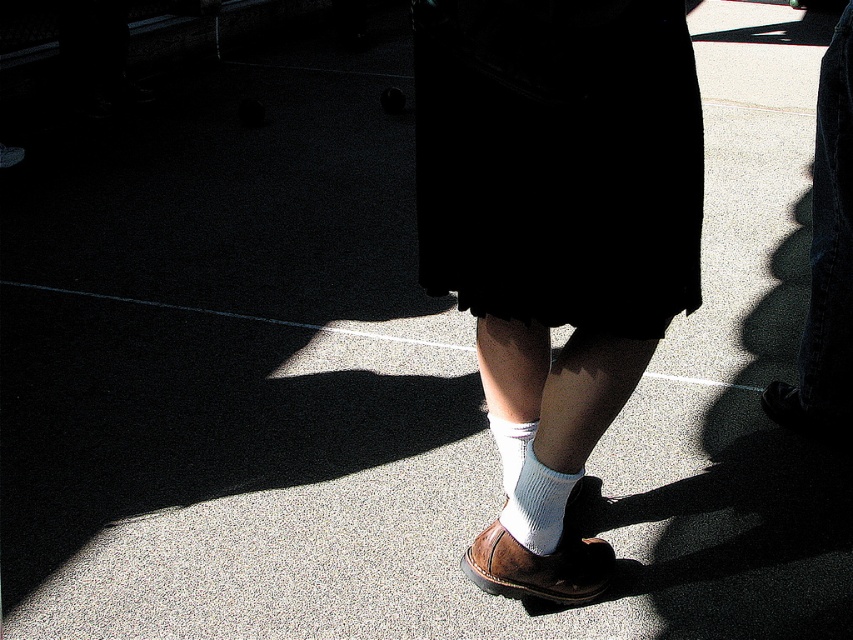
Question: Which object is the farthest from the black fabric skirt at center?

Choices:
 (A) brown leather shoe at lower center
 (B) white cotton socks at center

Answer: (B)

Question: Which object is the closest to the white knitted sock at lower center?

Choices:
 (A) white knitted sock at center
 (B) brown leather shoe at lower center
 (C) black fabric skirt at center
 (D) white cotton socks at center

Answer: (B)

Question: Can you confirm if white cotton socks at center is positioned above brown leather shoe at lower center?

Choices:
 (A) yes
 (B) no

Answer: (A)

Question: Among these objects, which one is farthest from the camera?

Choices:
 (A) brown leather shoe at lower center
 (B) black fabric skirt at center
 (C) white cotton socks at center

Answer: (C)

Question: In this image, where is white cotton socks at center located relative to white knitted sock at center?

Choices:
 (A) below
 (B) above

Answer: (B)

Question: Where is black fabric skirt at center located in relation to white knitted sock at center in the image?

Choices:
 (A) left
 (B) right

Answer: (B)